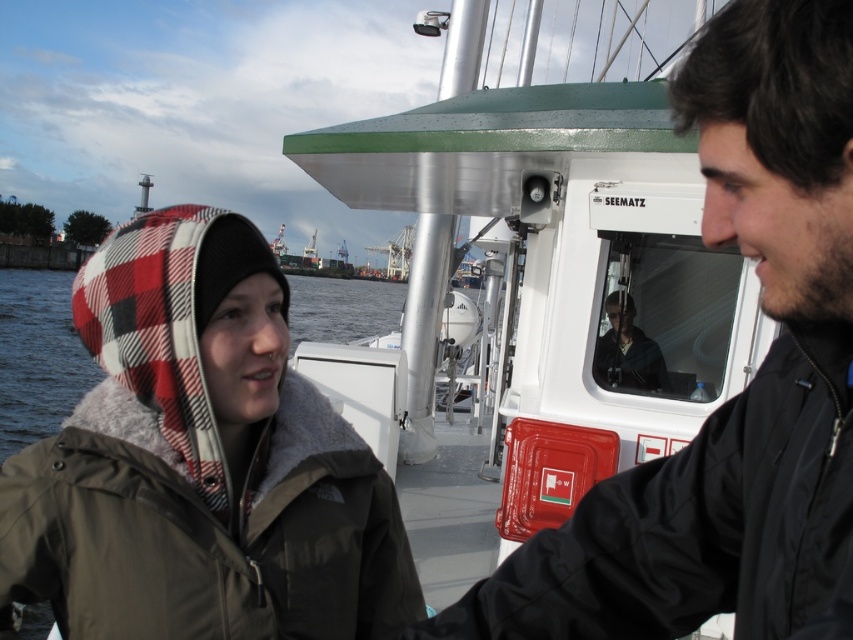
You are standing on the boat SEEMATZ and want to greet both people. If you start facing the plaid woolen hat at left, which direction should you turn to first see the black matte jacket at center?

Since the plaid woolen hat at left is to the left of the black matte jacket at center, you should turn to your right to face the black matte jacket at center.

You are a delivery drone carrying a package that requires a 10 feet minimum clearance to safely land between the black matte jacket at center and the matte black jacket at center. Based on the scene described, can you safely land there?

The distance between the black matte jacket at center and the matte black jacket at center is 9.75 feet, which is less than the required 10 feet clearance. Therefore, the drone cannot safely land there.

You are a tailor who needs to determine which jacket between the black matte jacket at center and the matte black jacket at center requires more fabric for alterations. Based on the scene, which one would you prioritize?

Result: The black matte jacket at center requires more fabric for alterations because its width is larger than the matte black jacket at center.